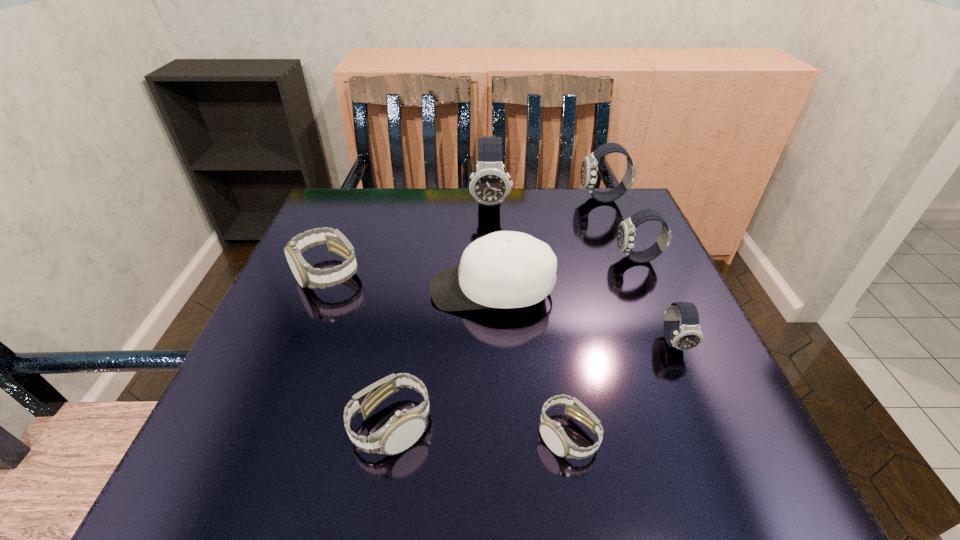
Find the location of a particular element. the second white watch from right to left is located at coordinates (959, 0).

Identify the location of the fourth watch from left to right. (959, 0).

Identify the location of the shortest watch. The width and height of the screenshot is (960, 540). (959, 0).

Identify the location of vacant region located on the face of the biggest dark watch. (493, 316).

Find the location of `free spot located on the face of the second tallest watch`. free spot located on the face of the second tallest watch is located at coordinates (447, 199).

The width and height of the screenshot is (960, 540). Identify the location of free space located on the face of the second tallest watch. (500, 199).

Image resolution: width=960 pixels, height=540 pixels. Find the location of `vacant space situated on the face of the second tallest watch`. vacant space situated on the face of the second tallest watch is located at coordinates (508, 199).

Identify the location of free space located on the front-facing side of the baseball cap. pyautogui.click(x=348, y=290).

This screenshot has height=540, width=960. Identify the location of vacant space positioned on the front-facing side of the baseball cap. (279, 290).

Locate an element on the screen. vacant space located 0.220m on the front-facing side of the baseball cap is located at coordinates (324, 290).